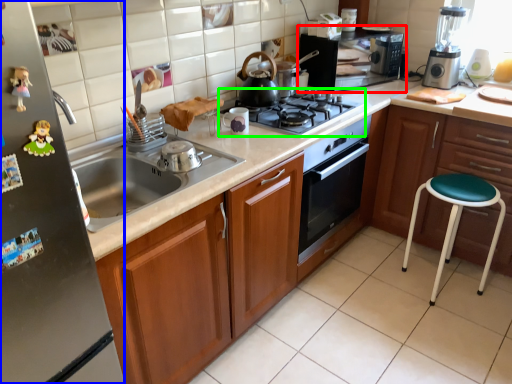
Question: Considering the real-world distances, which object is farthest from home appliance (highlighted by a red box)? fridge (highlighted by a blue box) or gas stove (highlighted by a green box)?

Choices:
 (A) fridge
 (B) gas stove

Answer: (A)